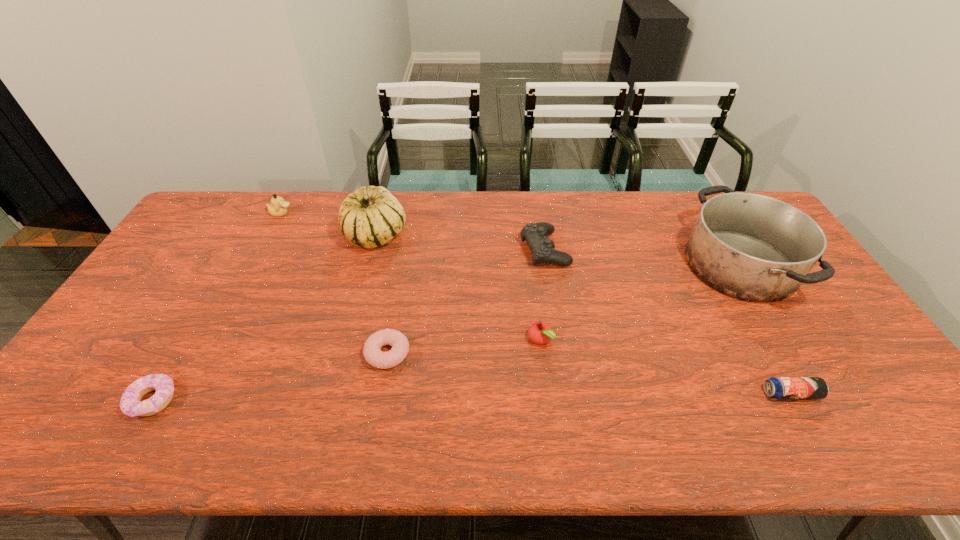
Identify the location of gourd. point(369,217).

The image size is (960, 540). I want to click on saucepan, so click(x=751, y=247).

Identify the location of duckling. The width and height of the screenshot is (960, 540). (277, 208).

You are a GUI agent. You are given a task and a screenshot of the screen. Output one action in this format:
    pyautogui.click(x=<x>, y=<y>)
    Task: Click on the control
    This screenshot has width=960, height=540.
    Given the screenshot: What is the action you would take?
    pyautogui.click(x=536, y=234)

The image size is (960, 540). I want to click on apple, so click(x=540, y=333).

Identify the location of beer can. (776, 387).

Locate an element on the screen. This screenshot has width=960, height=540. the right doughnut is located at coordinates (373, 355).

Find the location of a particular element. The height and width of the screenshot is (540, 960). the left doughnut is located at coordinates (130, 404).

At what (x,y) coordinates should I click in order to perform the action: click on free space located 0.280m on the front of the gourd. Please return your answer as a coordinate pair (x, y). Image resolution: width=960 pixels, height=540 pixels. Looking at the image, I should click on (352, 326).

Find the location of `vacant space situated 0.190m on the left of the saucepan`. vacant space situated 0.190m on the left of the saucepan is located at coordinates (626, 265).